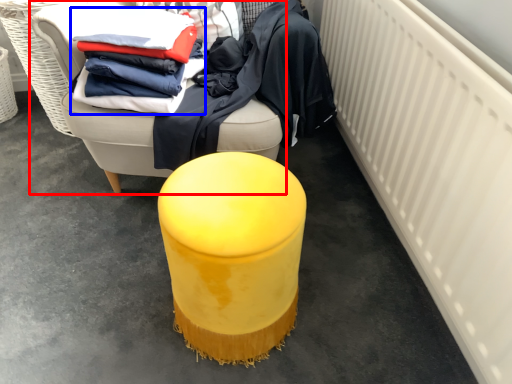
Question: Which object is further to the camera taking this photo, furniture (highlighted by a red box) or clothing (highlighted by a blue box)?

Choices:
 (A) furniture
 (B) clothing

Answer: (B)